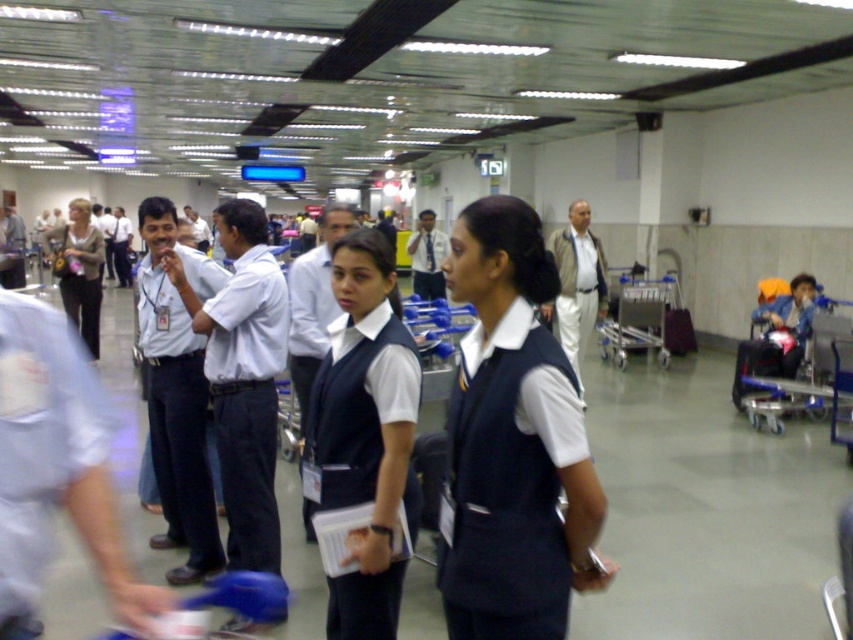
Question: Among these objects, which one is farthest from the camera?

Choices:
 (A) matte gray sweater at left
 (B) white fabric shirt at center

Answer: (A)

Question: Which point is closer to the camera?

Choices:
 (A) white fabric shirt at center
 (B) navy blue vest at center
 (C) light blue fabric shirt at left

Answer: (B)

Question: Does navy blue vest at center have a larger size compared to matte white shirt at center?

Choices:
 (A) yes
 (B) no

Answer: (A)

Question: Does navy blue fabric vest at center have a larger size compared to light blue fabric shirt at left?

Choices:
 (A) yes
 (B) no

Answer: (B)

Question: Based on their relative distances, which object is nearer to the light blue fabric shirt at left?

Choices:
 (A) navy blue vest at center
 (B) white fabric shirt at center
 (C) white fabric vest at center

Answer: (B)

Question: Is white fabric vest at center below matte white shirt at center?

Choices:
 (A) no
 (B) yes

Answer: (B)